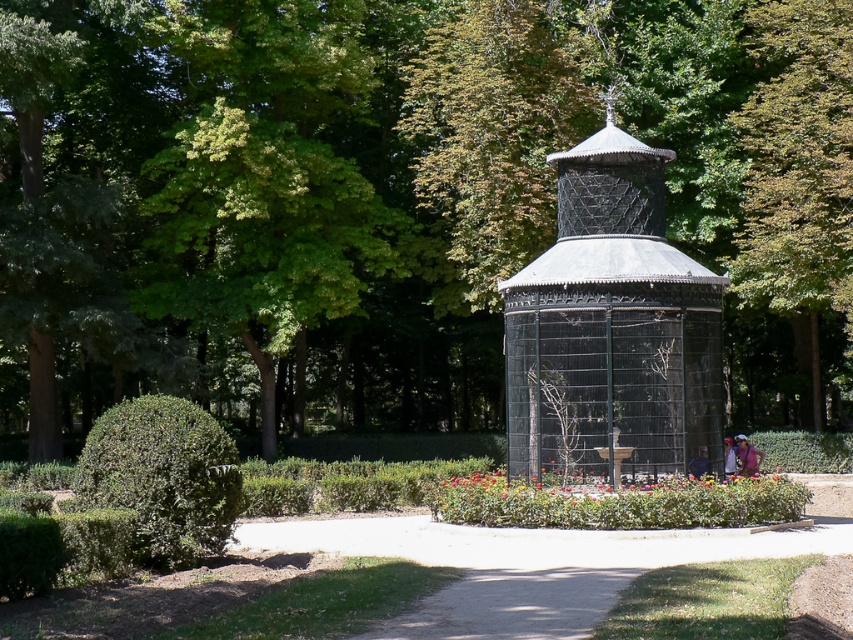
You are a photographer standing at the camera position in the park scene. You want to take a photo of the black metal gazebo at center. If your camera has a focal length of 50mm, which is optimal for capturing objects at this distance, would you need to adjust your position to ensure the gazebo fills the frame properly?

The black metal gazebo at center is 19.44 meters away from the camera. With a 50mm focal length, you may need to move closer to ensure the gazebo fills the frame adequately, as 19.44 meters might be too far for optimal framing at this focal length.

You are a park visitor who wants to take a photo of the black metal gazebo at center without any obstructions. However, there is a green leafy tree at center in the way. Can you suggest a direction to move so that the tree is no longer blocking your view of the gazebo?

The green leafy tree at center is above the black metal gazebo at center. To avoid the obstruction, move to a position where you can look upward or adjust your angle to capture the gazebo below the tree.

You are standing at the center of the park and see the point marked at coordinates (402, 196). What object does this point represent?

The point marked at coordinates (402, 196) represents the green leafy tree at center.